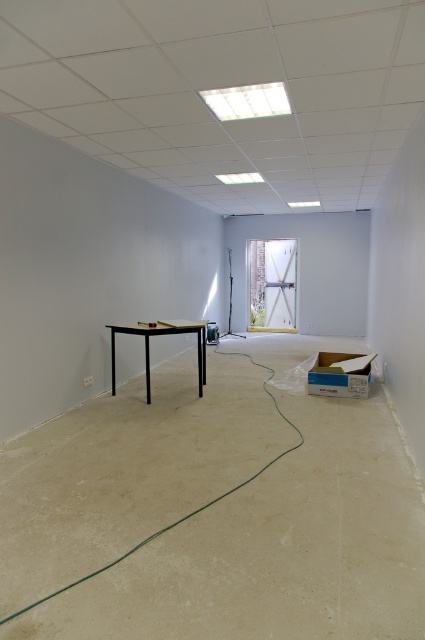
In the scene shown: You are an interior designer assessing the room layout. You need to determine if the transparent glass window at upper center can be covered by a decorative panel that is the same height as the black matte table at center. Based on their heights, will the panel fit vertically?

The transparent glass window at upper center is shorter than the black matte table at center. Since the panel is the same height as the table, it would be taller than the window, so the panel cannot fit vertically without overlapping the window or requiring trimming.

You are standing in the room and want to look outside through the clear glass window at center. To do so, which direction should you move relative to the black matte table at center?

You should move to the right of the black matte table at center because the clear glass window at center is located to the right of it.

You are an interior designer who needs to place a large piece of furniture that requires a clear view of the clear glass window at center. The furniture is too big to fit on the black matte table at center. Where should you position the furniture to ensure it doesn

The clear glass window at center is larger in size than the black matte table at center, so positioning the furniture near the clear glass window at center would provide a clear view without obstructing the larger window.